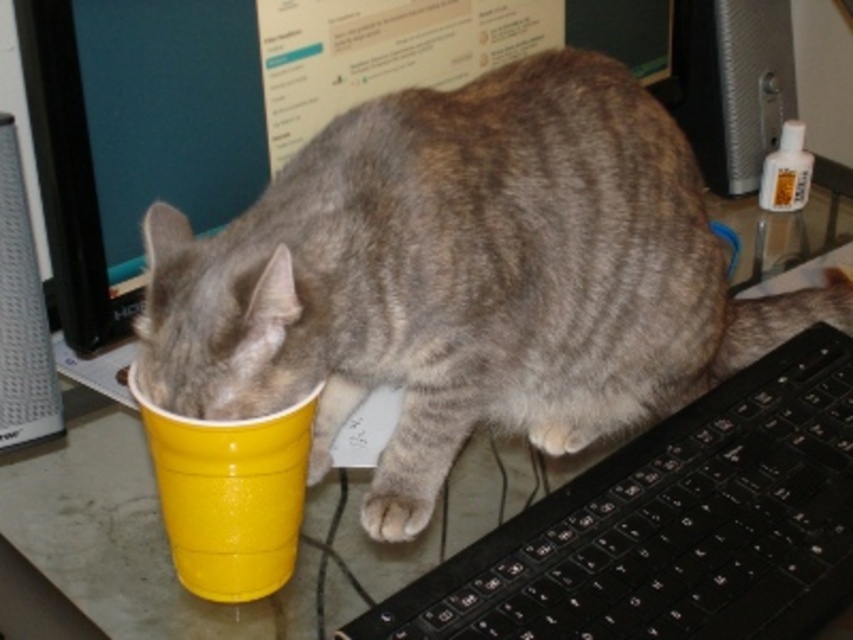
Question: Estimate the real-world distances between objects in this image. Which object is farther from the brushed metal computer tower at left?

Choices:
 (A) black plastic keyboard at lower right
 (B) white fur paw at lower center
 (C) gray striped cat at center
 (D) yellow plastic cup at lower left

Answer: (A)

Question: Which object is positioned farthest from the yellow plastic cup at lower left?

Choices:
 (A) white fur paw at lower center
 (B) gray striped cat at center
 (C) black plastic keyboard at lower right
 (D) brushed metal computer tower at left

Answer: (C)

Question: Does black plastic keyboard at lower right appear on the right side of yellow plastic cup at lower left?

Choices:
 (A) no
 (B) yes

Answer: (B)

Question: Can you confirm if black plastic keyboard at lower right is wider than brushed metal computer tower at left?

Choices:
 (A) yes
 (B) no

Answer: (A)

Question: Can you confirm if black plastic keyboard at lower right is positioned to the left of yellow plastic cup at lower left?

Choices:
 (A) no
 (B) yes

Answer: (A)

Question: Among these objects, which one is nearest to the camera?

Choices:
 (A) white fur paw at lower center
 (B) black plastic keyboard at lower right
 (C) yellow plastic cup at lower left

Answer: (C)